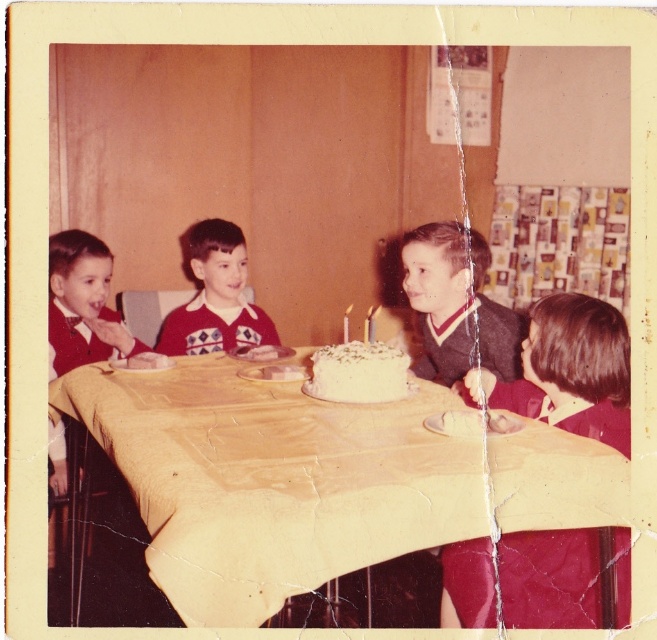
You are a photographer analyzing this vintage birthday photo. You notice the dark brown hair at right and the dark gray sweater at center. Which object is closer to the camera?

The dark brown hair at right is closer to the camera because it is in front of the dark gray sweater at center.

You are a guest at the birthday party and want to light the candle on the white wax candle at center. However, there is a dark gray sweater at center in the way. Can you light the candle without moving the sweater?

The dark gray sweater at center is much taller than the white wax candle at center, so it would block access to the candle. You would need to move the sweater to light the candle.

You are a guest at this birthday party and want to blow out the candles on the white wax candle at center. Can you reach the candle if you are sitting at the edge of the table where the white frosted cake at center is located?

The white frosted cake at center is larger in size than the white wax candle at center, so you can reach the candle since it is smaller and closer to the edge of the table.